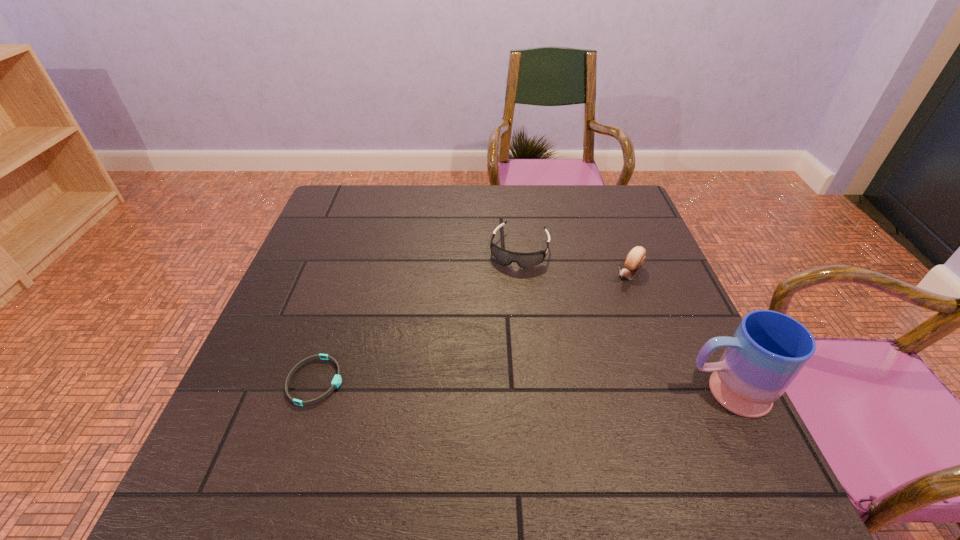
Select which object appears as the second closest to the second tallest object. Please provide its 2D coordinates. Your answer should be formatted as a tuple, i.e. [(x, y)], where the tuple contains the x and y coordinates of a point satisfying the conditions above.

[(768, 350)]

This screenshot has width=960, height=540. In order to click on blank area in the image that satisfies the following two spatial constraints: 1. on the front side of the escargot; 2. on the side of the mug with the handle in this screenshot , I will do `click(673, 392)`.

Where is `vacant point that satisfies the following two spatial constraints: 1. on the front side of the mug; 2. on the side of the goggles with the handle`? vacant point that satisfies the following two spatial constraints: 1. on the front side of the mug; 2. on the side of the goggles with the handle is located at coordinates (535, 392).

You are a GUI agent. You are given a task and a screenshot of the screen. Output one action in this format:
    pyautogui.click(x=<x>, y=<y>)
    Task: Click on the vacant space that satisfies the following two spatial constraints: 1. on the front side of the tallest object; 2. on the side of the escargot with the handle
    Image resolution: width=960 pixels, height=540 pixels.
    Given the screenshot: What is the action you would take?
    pyautogui.click(x=673, y=392)